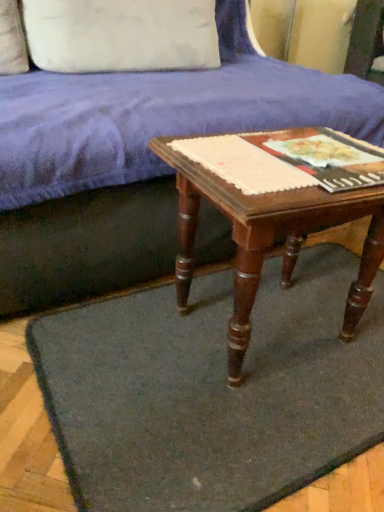
What are the coordinates of `free location above dark gray felt mat at center (from a real-world perspective)` in the screenshot? It's located at pos(249,362).